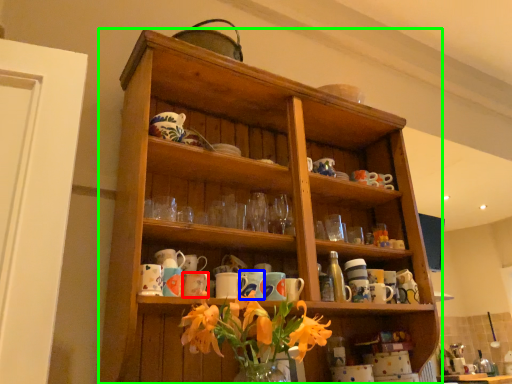
Question: Which object is the farthest from mug (highlighted by a red box)? Choose among these: mug (highlighted by a blue box) or shelf (highlighted by a green box).

Choices:
 (A) mug
 (B) shelf

Answer: (B)